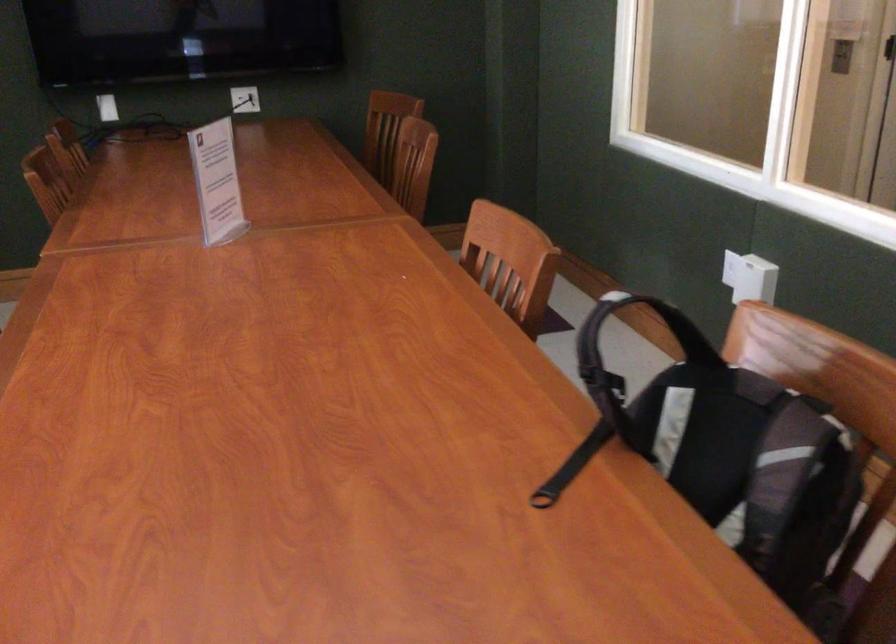
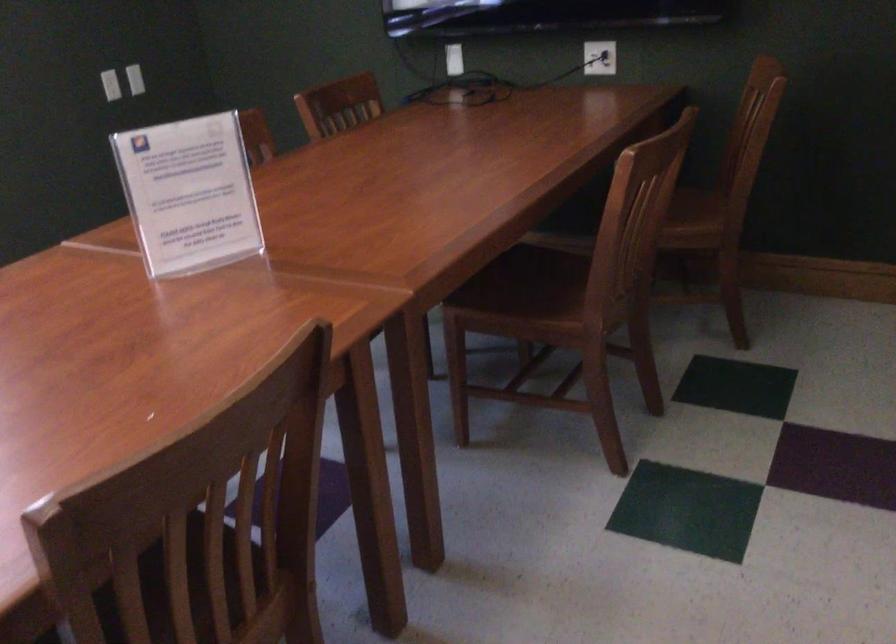
Locate, in the second image, the point that corresponds to point 410,176 in the first image.

(668, 205)